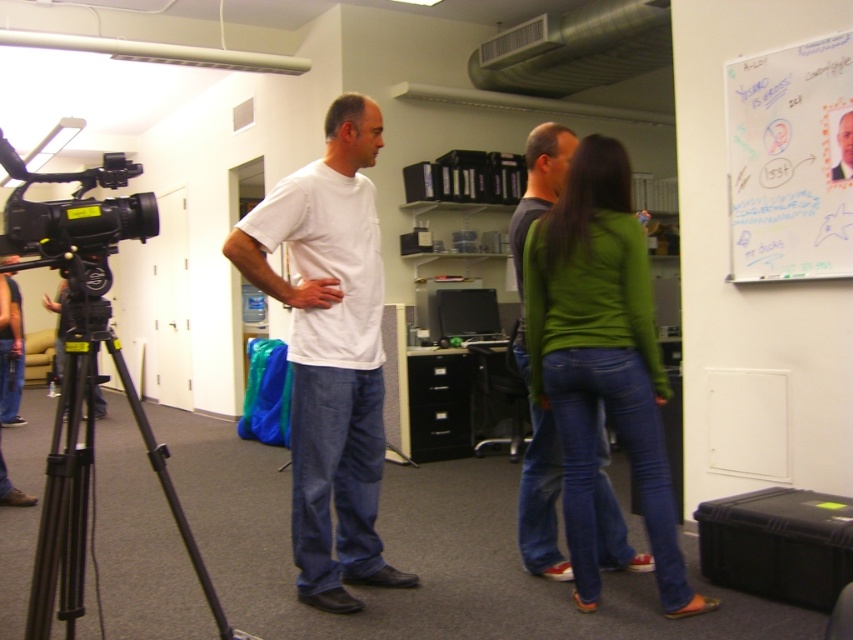
Question: Is whiteboard at upper right closer to camera compared to black metal tripod at left?

Choices:
 (A) yes
 (B) no

Answer: (B)

Question: Does white matte t-shirt at center appear on the right side of black metal tripod at left?

Choices:
 (A) yes
 (B) no

Answer: (A)

Question: Which of the following is the farthest from the observer?

Choices:
 (A) black metal tripod at left
 (B) green matte shirt at center

Answer: (B)

Question: Which point is farther to the camera?

Choices:
 (A) (119, 340)
 (B) (828, 225)

Answer: (A)

Question: In this image, where is white matte t-shirt at center located relative to black metal tripod at left?

Choices:
 (A) below
 (B) above

Answer: (B)

Question: Which of the following is the closest to the observer?

Choices:
 (A) white matte t-shirt at center
 (B) black metal tripod at left
 (C) green matte shirt at center
 (D) whiteboard at upper right

Answer: (B)